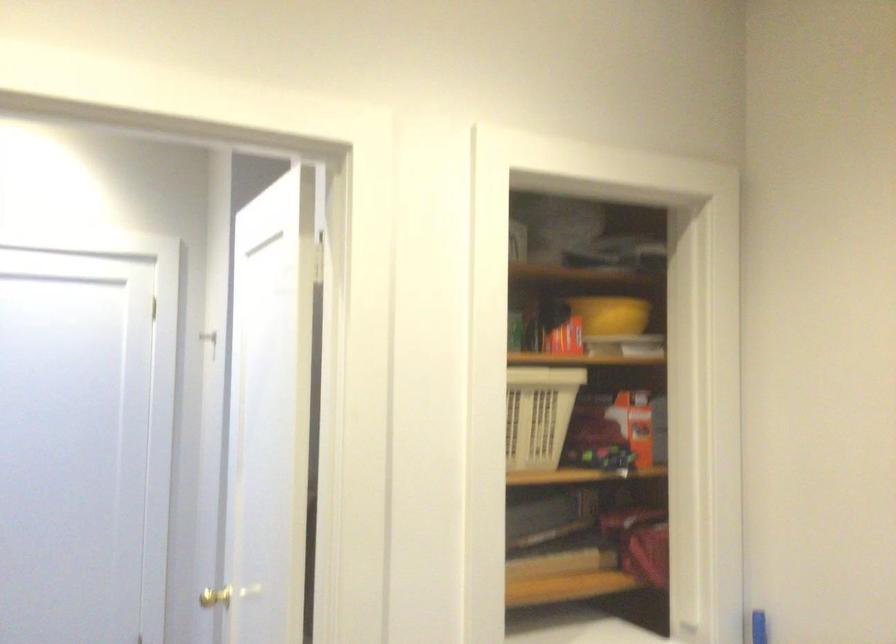
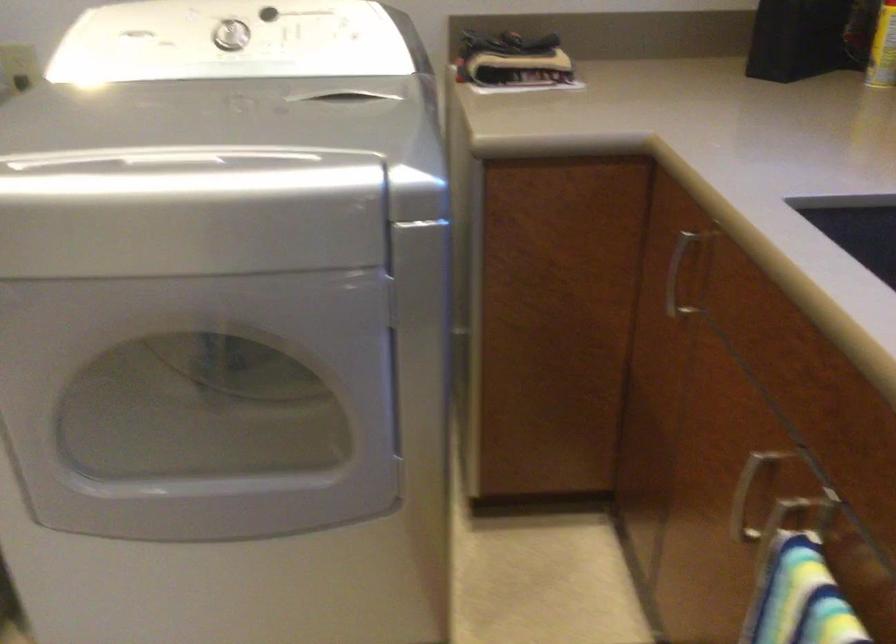
The first image is from the beginning of the video and the second image is from the end. How did the camera likely rotate when shooting the video?

The camera rotated toward right-down.